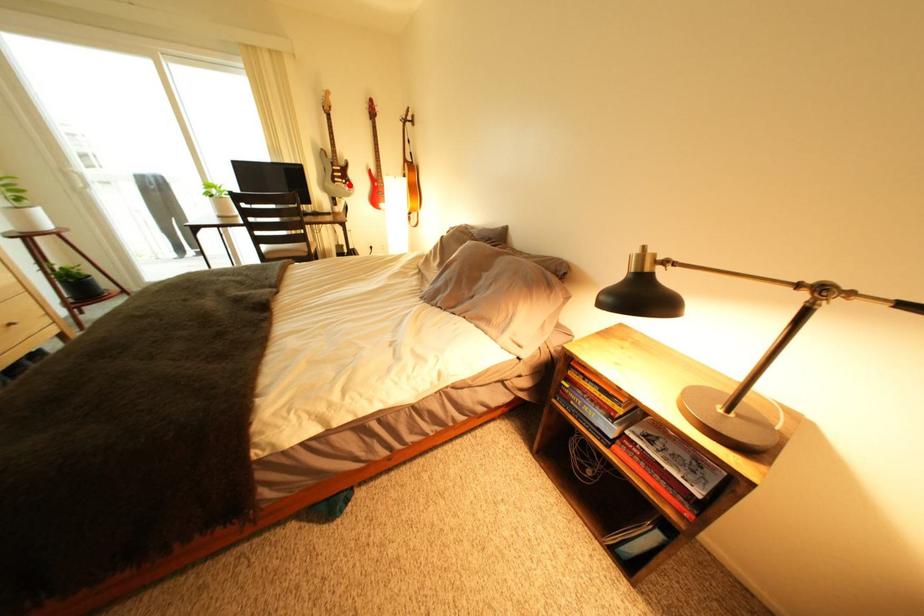
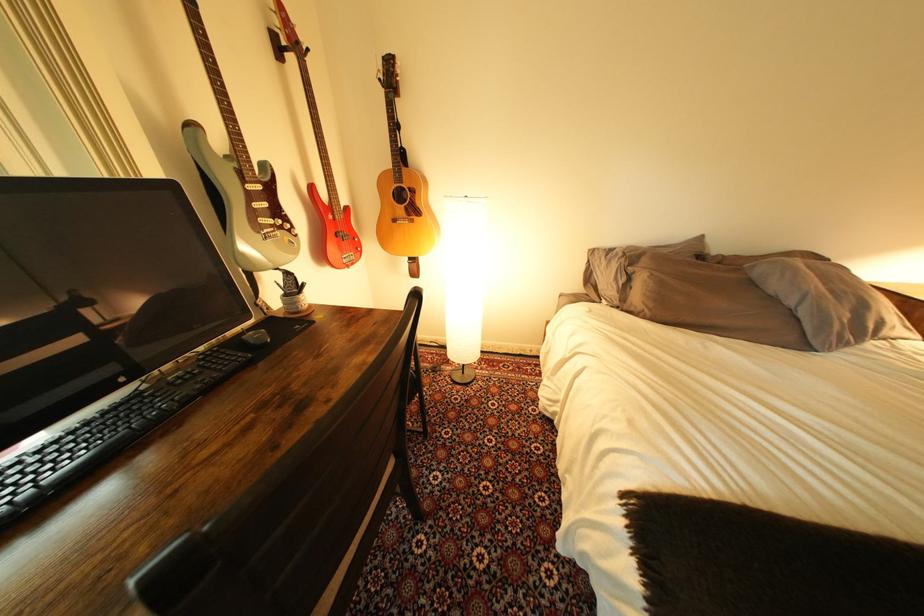
In the second image, find the point that corresponds to the highlighted location in the first image.

(278, 233)